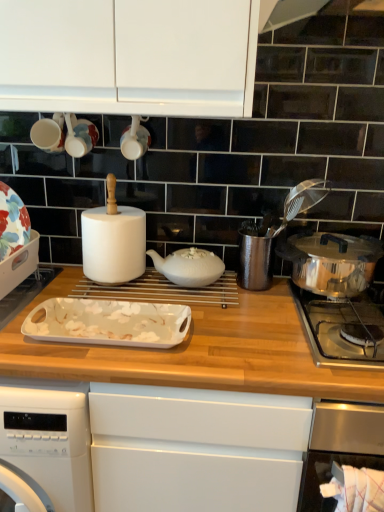
What do you see at coordinates (108, 322) in the screenshot?
I see `white glossy tray at center, arranged as the 2th kitchen appliance when viewed from the left` at bounding box center [108, 322].

What do you see at coordinates (334, 332) in the screenshot? The image size is (384, 512). I see `polished stainless steel pot at right` at bounding box center [334, 332].

What is the approximate width of white glossy cup at upper center?

white glossy cup at upper center is 11.09 centimeters wide.

Describe the element at coordinates (331, 262) in the screenshot. I see `polished stainless steel pot at right, arranged as the first kitchen appliance when viewed from the right` at that location.

What is the approximate width of white ceramic teapot at center?

8.25 inches.

You are a GUI agent. You are given a task and a screenshot of the screen. Output one action in this format:
    pyautogui.click(x=<x>, y=<y>)
    Task: Click on the white glossy tray at center, arranged as the 2th kitchen appliance when viewed from the left
    
    Given the screenshot: What is the action you would take?
    pyautogui.click(x=108, y=322)

Find the location of a particular element. Image resolution: width=384 pixels, height=512 pixels. the 2nd kitchen appliance counting from the left of the white glossy cup at upper center is located at coordinates (19, 265).

Which is in front, white glossy cup at upper center or white glossy tray at left, acting as the first kitchen appliance starting from the left?

white glossy tray at left, acting as the first kitchen appliance starting from the left, is closer to the camera.

Considering the positions of objects white glossy cup at upper center and white glossy tray at left, acting as the first kitchen appliance starting from the left, in the image provided, who is more to the left, white glossy cup at upper center or white glossy tray at left, acting as the first kitchen appliance starting from the left,?

Positioned to the left is white glossy tray at left, acting as the first kitchen appliance starting from the left.

Who is taller, white glossy cup at upper center or white glossy tray at left, the 3th kitchen appliance in the right-to-left sequence?

Standing taller between the two is white glossy tray at left, the 3th kitchen appliance in the right-to-left sequence.

Between white glossy tray at left, the 3th kitchen appliance in the right-to-left sequence, and polished stainless steel pot at right, arranged as the first kitchen appliance when viewed from the right, which one has larger width?

polished stainless steel pot at right, arranged as the first kitchen appliance when viewed from the right, is wider.

How many degrees apart are the facing directions of white glossy tray at left, acting as the first kitchen appliance starting from the left, and polished stainless steel pot at right, placed as the third kitchen appliance when sorted from left to right?

The angle between the facing direction of white glossy tray at left, acting as the first kitchen appliance starting from the left, and the facing direction of polished stainless steel pot at right, placed as the third kitchen appliance when sorted from left to right, is 0.679 degrees.

Would you consider white glossy tray at left, acting as the first kitchen appliance starting from the left, to be distant from polished stainless steel pot at right, arranged as the first kitchen appliance when viewed from the right?

Actually, white glossy tray at left, acting as the first kitchen appliance starting from the left, and polished stainless steel pot at right, arranged as the first kitchen appliance when viewed from the right, are a little close together.

Is white glossy tray at center, which is the second kitchen appliance in right-to-left order, bigger than polished stainless steel pot at right?

Actually, white glossy tray at center, which is the second kitchen appliance in right-to-left order, might be smaller than polished stainless steel pot at right.

Would you say white glossy tray at center, arranged as the 2th kitchen appliance when viewed from the left, is outside polished stainless steel pot at right?

Yes, white glossy tray at center, arranged as the 2th kitchen appliance when viewed from the left, is not within polished stainless steel pot at right.

From a real-world perspective, which object stands above the other?

In real-world perspective, white glossy tray at center, arranged as the 2th kitchen appliance when viewed from the left, is above.

Consider the image. Is white glossy tray at center, arranged as the 2th kitchen appliance when viewed from the left, looking in the opposite direction of polished stainless steel pot at right?

white glossy tray at center, arranged as the 2th kitchen appliance when viewed from the left, does not have its back to polished stainless steel pot at right.

Can you confirm if white glossy cup at upper center is positioned to the right of white glossy tray at center, which is the second kitchen appliance in right-to-left order?

Indeed, white glossy cup at upper center is positioned on the right side of white glossy tray at center, which is the second kitchen appliance in right-to-left order.

Is white glossy cup at upper center facing away from white glossy tray at center, which is the second kitchen appliance in right-to-left order?

No, white glossy cup at upper center is not facing the opposite direction of white glossy tray at center, which is the second kitchen appliance in right-to-left order.

From a real-world perspective, between white glossy cup at upper center and white glossy tray at center, which is the second kitchen appliance in right-to-left order, who is vertically lower?

white glossy tray at center, which is the second kitchen appliance in right-to-left order, is physically lower.

Based on their positions, is white glossy tray at center, arranged as the 2th kitchen appliance when viewed from the left, located to the left or right of polished stainless steel pot at right, arranged as the first kitchen appliance when viewed from the right?

Based on their positions, white glossy tray at center, arranged as the 2th kitchen appliance when viewed from the left, is located to the left of polished stainless steel pot at right, arranged as the first kitchen appliance when viewed from the right.

Can you confirm if white glossy tray at center, which is the second kitchen appliance in right-to-left order, is smaller than polished stainless steel pot at right, placed as the third kitchen appliance when sorted from left to right?

Indeed, white glossy tray at center, which is the second kitchen appliance in right-to-left order, has a smaller size compared to polished stainless steel pot at right, placed as the third kitchen appliance when sorted from left to right.

Is polished stainless steel pot at right, arranged as the first kitchen appliance when viewed from the right, at the back of white glossy tray at center, arranged as the 2th kitchen appliance when viewed from the left?

white glossy tray at center, arranged as the 2th kitchen appliance when viewed from the left, is not turned away from polished stainless steel pot at right, arranged as the first kitchen appliance when viewed from the right.

Considering the sizes of objects white ceramic teapot at center and white glossy tray at center, arranged as the 2th kitchen appliance when viewed from the left, in the image provided, who is taller, white ceramic teapot at center or white glossy tray at center, arranged as the 2th kitchen appliance when viewed from the left,?

Standing taller between the two is white ceramic teapot at center.

Considering the positions of objects white ceramic teapot at center and white glossy tray at center, which is the second kitchen appliance in right-to-left order, in the image provided, who is in front, white ceramic teapot at center or white glossy tray at center, which is the second kitchen appliance in right-to-left order,?

white glossy tray at center, which is the second kitchen appliance in right-to-left order, is in front.

Does white ceramic teapot at center have a lesser width compared to white glossy tray at center, arranged as the 2th kitchen appliance when viewed from the left?

Indeed, white ceramic teapot at center has a lesser width compared to white glossy tray at center, arranged as the 2th kitchen appliance when viewed from the left.

How different are the orientations of white ceramic teapot at center and white glossy tray at center, which is the second kitchen appliance in right-to-left order, in degrees?

0.837 degrees.

Would you say white glossy tray at left, acting as the first kitchen appliance starting from the left, is inside or outside white ceramic teapot at center?

white glossy tray at left, acting as the first kitchen appliance starting from the left, is spatially situated outside white ceramic teapot at center.

Considering the relative sizes of white glossy tray at left, acting as the first kitchen appliance starting from the left, and white ceramic teapot at center in the image provided, is white glossy tray at left, acting as the first kitchen appliance starting from the left, shorter than white ceramic teapot at center?

Incorrect, the height of white glossy tray at left, acting as the first kitchen appliance starting from the left, does not fall short of that of white ceramic teapot at center.

How different are the orientations of white glossy tray at left, acting as the first kitchen appliance starting from the left, and white ceramic teapot at center in degrees?

They differ by 0.0122 degrees in their facing directions.

Where is `appliance located above the white glossy tray at left, the 3th kitchen appliance in the right-to-left sequence (from a real-world perspective)`? This screenshot has width=384, height=512. appliance located above the white glossy tray at left, the 3th kitchen appliance in the right-to-left sequence (from a real-world perspective) is located at coordinates (135, 139).

Where is `kitchen appliance above the white glossy tray at left, acting as the first kitchen appliance starting from the left (from the image's perspective)`? kitchen appliance above the white glossy tray at left, acting as the first kitchen appliance starting from the left (from the image's perspective) is located at coordinates (331, 262).

Looking at the image, which one is located closer to polished stainless steel pot at right, white glossy tray at center, arranged as the 2th kitchen appliance when viewed from the left, or polished stainless steel pot at right, arranged as the first kitchen appliance when viewed from the right?

polished stainless steel pot at right, arranged as the first kitchen appliance when viewed from the right, is closer to polished stainless steel pot at right.

Looking at the image, which one is located closer to white glossy tray at left, the 3th kitchen appliance in the right-to-left sequence, polished stainless steel pot at right, placed as the third kitchen appliance when sorted from left to right, or polished stainless steel pot at right?

polished stainless steel pot at right lies closer to white glossy tray at left, the 3th kitchen appliance in the right-to-left sequence, than the other object.

When comparing their distances from polished stainless steel pot at right, does white glossy tray at center, which is the second kitchen appliance in right-to-left order, or white ceramic teapot at center seem further?

white glossy tray at center, which is the second kitchen appliance in right-to-left order, is further to polished stainless steel pot at right.

When comparing their distances from white ceramic teapot at center, does polished stainless steel pot at right or white glossy tray at center, which is the second kitchen appliance in right-to-left order, seem closer?

white glossy tray at center, which is the second kitchen appliance in right-to-left order, is positioned closer to the anchor white ceramic teapot at center.

Based on their spatial positions, is white glossy tray at center, arranged as the 2th kitchen appliance when viewed from the left, or white glossy cup at upper center further from polished stainless steel pot at right?

white glossy cup at upper center.

In the scene shown: Which object lies nearer to the anchor point white glossy tray at left, acting as the first kitchen appliance starting from the left, white ceramic teapot at center or polished stainless steel pot at right?

The object closer to white glossy tray at left, acting as the first kitchen appliance starting from the left, is white ceramic teapot at center.

Looking at the image, which one is located closer to white glossy tray at left, the 3th kitchen appliance in the right-to-left sequence, white glossy cup at upper center or polished stainless steel pot at right?

white glossy cup at upper center.

When comparing their distances from polished stainless steel pot at right, does white glossy tray at left, acting as the first kitchen appliance starting from the left, or polished stainless steel pot at right, arranged as the first kitchen appliance when viewed from the right, seem further?

white glossy tray at left, acting as the first kitchen appliance starting from the left, lies further to polished stainless steel pot at right than the other object.

At what (x,y) coordinates should I click in order to perform the action: click on kitchen appliance situated between white glossy tray at center, which is the second kitchen appliance in right-to-left order, and polished stainless steel pot at right from left to right. Please return your answer as a coordinate pair (x, y). Image resolution: width=384 pixels, height=512 pixels. Looking at the image, I should click on (331, 262).

Locate an element on the screen. The height and width of the screenshot is (512, 384). kitchen appliance between white glossy cup at upper center and polished stainless steel pot at right is located at coordinates (331, 262).

This screenshot has height=512, width=384. I want to click on tableware between white glossy tray at left, acting as the first kitchen appliance starting from the left, and polished stainless steel pot at right, in the horizontal direction, so click(x=189, y=266).

You are a GUI agent. You are given a task and a screenshot of the screen. Output one action in this format:
    pyautogui.click(x=<x>, y=<y>)
    Task: Click on the tableware situated between white glossy tray at center, which is the second kitchen appliance in right-to-left order, and polished stainless steel pot at right, arranged as the first kitchen appliance when viewed from the right, from left to right
    Image resolution: width=384 pixels, height=512 pixels.
    Given the screenshot: What is the action you would take?
    pyautogui.click(x=189, y=266)